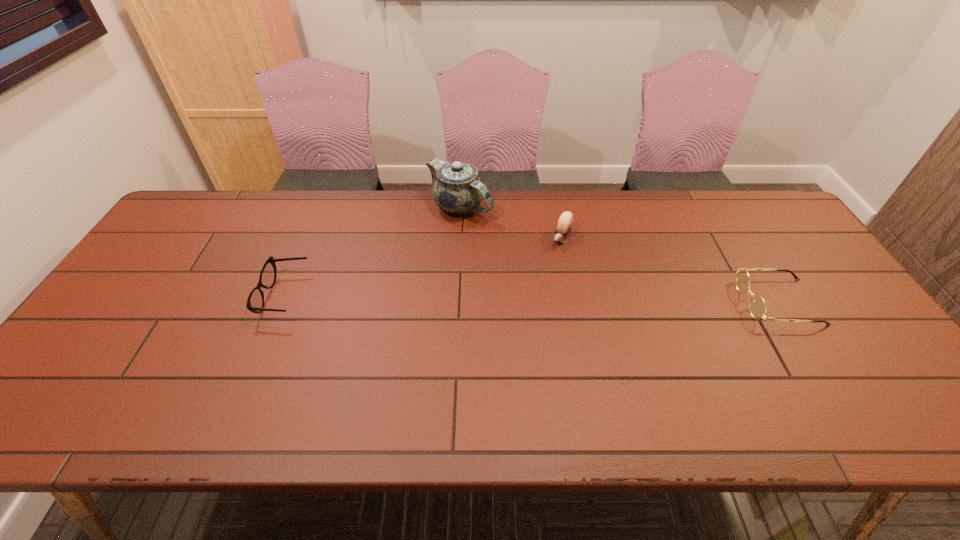
At what (x,y) coordinates should I click in order to perform the action: click on vacant space on the desktop that is between the left spectacles and the rightmost object and is positioned on the front-facing side of the escargot. Please return your answer as a coordinate pair (x, y). The height and width of the screenshot is (540, 960). Looking at the image, I should click on (526, 299).

At what (x,y) coordinates should I click in order to perform the action: click on vacant spot on the desktop that is between the left spectacles and the right spectacles and is positioned from the spout of the chinaware. Please return your answer as a coordinate pair (x, y). The height and width of the screenshot is (540, 960). Looking at the image, I should click on (542, 300).